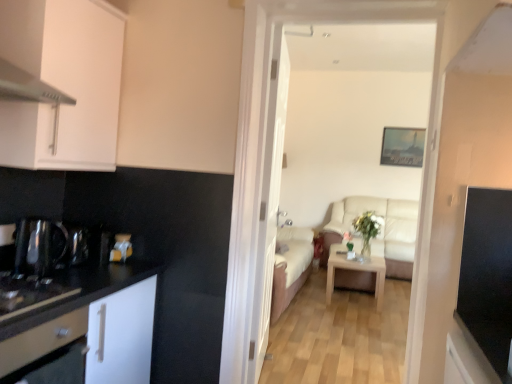
Describe the element at coordinates (487, 280) in the screenshot. I see `black glossy tv at right, the 2th appliance viewed from the left` at that location.

This screenshot has width=512, height=384. What do you see at coordinates (60, 84) in the screenshot? I see `white matte cabinet at upper left, acting as the first cabinetry starting from the top` at bounding box center [60, 84].

Find the location of a particular element. beige leather couch at center is located at coordinates (381, 232).

What is the approximate width of beige leather couch at center?

beige leather couch at center is 92.77 centimeters wide.

Measure the distance between black matte dishwasher at lower left and camera.

black matte dishwasher at lower left and camera are 1.25 meters apart from each other.

What do you see at coordinates (86, 326) in the screenshot? I see `white matte cabinet at left, the second cabinetry from the top` at bounding box center [86, 326].

The height and width of the screenshot is (384, 512). Identify the location of black glossy tv at right, which ranks as the first appliance in right-to-left order. (487, 280).

From the image's perspective, is white matte cabinet at upper left, the second cabinetry in the bottom-to-top sequence, below black glossy tv at right, which ranks as the first appliance in right-to-left order?

Actually, white matte cabinet at upper left, the second cabinetry in the bottom-to-top sequence, appears above black glossy tv at right, which ranks as the first appliance in right-to-left order, in the image.

Considering the relative sizes of white matte cabinet at upper left, the second cabinetry in the bottom-to-top sequence, and black glossy tv at right, which ranks as the first appliance in right-to-left order, in the image provided, is white matte cabinet at upper left, the second cabinetry in the bottom-to-top sequence, wider than black glossy tv at right, which ranks as the first appliance in right-to-left order,?

Indeed, white matte cabinet at upper left, the second cabinetry in the bottom-to-top sequence, has a greater width compared to black glossy tv at right, which ranks as the first appliance in right-to-left order.

What's the angular difference between white matte cabinet at upper left, the second cabinetry in the bottom-to-top sequence, and black glossy tv at right, the 2th appliance viewed from the left,'s facing directions?

90 degrees.

Is white matte cabinet at upper left, the second cabinetry in the bottom-to-top sequence, positioned far away from black glossy tv at right, the 2th appliance viewed from the left?

white matte cabinet at upper left, the second cabinetry in the bottom-to-top sequence, is far away from black glossy tv at right, the 2th appliance viewed from the left.

Between point (329, 274) and point (281, 110), which one is positioned in front?

The point (281, 110) is closer to the camera.

Between light wood/texture coffee table at center and white wooden door at center, which one has smaller width?

With smaller width is white wooden door at center.

Would you say light wood/texture coffee table at center is a long distance from white wooden door at center?

light wood/texture coffee table at center is positioned a significant distance from white wooden door at center.

Is light wood/texture coffee table at center at the right side of white wooden door at center?

Correct, you'll find light wood/texture coffee table at center to the right of white wooden door at center.

Considering the relative positions of beige fabric sofa at center and beige leather couch at center in the image provided, is beige fabric sofa at center behind beige leather couch at center?

No, beige fabric sofa at center is closer to the camera.

Is beige fabric sofa at center surrounding beige leather couch at center?

No, beige leather couch at center is located outside of beige fabric sofa at center.

Is point (372, 17) positioned in front of point (394, 203)?

That is True.

Considering the relative positions of beige fabric sofa at center and beige leather couch at center in the image provided, is beige fabric sofa at center to the left or to the right of beige leather couch at center?

Clearly, beige fabric sofa at center is on the left of beige leather couch at center in the image.

Which is more to the left, white matte cabinet at left, the second cabinetry from the top, or white glossy drawer at left?

Positioned to the left is white matte cabinet at left, the second cabinetry from the top.

Are white matte cabinet at left, the second cabinetry from the top, and white glossy drawer at left far apart?

No, there isn't a large distance between white matte cabinet at left, the second cabinetry from the top, and white glossy drawer at left.

Consider the image. Between white matte cabinet at left, the second cabinetry from the top, and white glossy drawer at left, which one has smaller width?

With smaller width is white glossy drawer at left.

Is white matte cabinet at upper left, acting as the first cabinetry starting from the top, not close to beige leather couch at center?

That's right, there is a large distance between white matte cabinet at upper left, acting as the first cabinetry starting from the top, and beige leather couch at center.

Can you tell me how much white matte cabinet at upper left, the second cabinetry in the bottom-to-top sequence, and beige leather couch at center differ in facing direction?

The facing directions of white matte cabinet at upper left, the second cabinetry in the bottom-to-top sequence, and beige leather couch at center are 91.7 degrees apart.

Between white matte cabinet at upper left, acting as the first cabinetry starting from the top, and beige leather couch at center, which one is positioned behind?

beige leather couch at center is behind.

Based on their sizes in the image, would you say white matte cabinet at upper left, the second cabinetry in the bottom-to-top sequence, is bigger or smaller than beige leather couch at center?

white matte cabinet at upper left, the second cabinetry in the bottom-to-top sequence, is smaller than beige leather couch at center.

Is white matte cabinet at upper left, the second cabinetry in the bottom-to-top sequence, beside beige fabric sofa at center?

There is a gap between white matte cabinet at upper left, the second cabinetry in the bottom-to-top sequence, and beige fabric sofa at center.

Considering the relative positions of white matte cabinet at upper left, acting as the first cabinetry starting from the top, and beige fabric sofa at center in the image provided, is white matte cabinet at upper left, acting as the first cabinetry starting from the top, behind beige fabric sofa at center?

That is False.

Is white matte cabinet at upper left, acting as the first cabinetry starting from the top, bigger than beige fabric sofa at center?

No, white matte cabinet at upper left, acting as the first cabinetry starting from the top, is not bigger than beige fabric sofa at center.

Is white matte cabinet at upper left, acting as the first cabinetry starting from the top, spatially inside beige fabric sofa at center, or outside of it?

white matte cabinet at upper left, acting as the first cabinetry starting from the top, exists outside the volume of beige fabric sofa at center.

Could you tell me if white wooden door at center is turned towards shiny metallic kettle at left, which appears as the second appliance when viewed from the right?

No, white wooden door at center is not turned towards shiny metallic kettle at left, which appears as the second appliance when viewed from the right.

From a real-world perspective, is white wooden door at center physically located above or below shiny metallic kettle at left, which appears as the second appliance when viewed from the right?

From a real-world perspective, white wooden door at center is physically above shiny metallic kettle at left, which appears as the second appliance when viewed from the right.

Which is less distant, [273,124] or [26,226]?

The point [26,226] is more forward.

Find the location of a particular element. Image resolution: width=512 pixels, height=384 pixels. the 2nd appliance in front of the white wooden door at center, counting from the anchor's position is located at coordinates (39, 247).

Where is `the 2nd appliance counting from the right of the white matte cabinet at upper left, the second cabinetry in the bottom-to-top sequence`? The width and height of the screenshot is (512, 384). the 2nd appliance counting from the right of the white matte cabinet at upper left, the second cabinetry in the bottom-to-top sequence is located at coordinates (487, 280).

Identify the location of door above the light wood/texture coffee table at center (from a real-world perspective). The width and height of the screenshot is (512, 384). (267, 202).

Estimate the real-world distances between objects in this image. Which object is further from beige leather couch at center, white glossy drawer at left or white wooden door at center?

white glossy drawer at left is further to beige leather couch at center.

When comparing their distances from beige leather couch at center, does white matte cabinet at upper left, acting as the first cabinetry starting from the top, or white glossy drawer at left seem further?

Among the two, white glossy drawer at left is located further to beige leather couch at center.

From the image, which object appears to be farther from white matte cabinet at left, arranged as the first cabinetry when ordered from the bottom, black matte sink at lower left or black glossy tv at right, which ranks as the first appliance in right-to-left order?

black glossy tv at right, which ranks as the first appliance in right-to-left order, is positioned further to the anchor white matte cabinet at left, arranged as the first cabinetry when ordered from the bottom.

From the image, which object appears to be nearer to white matte cabinet at left, the second cabinetry from the top, white wooden door at center or beige leather couch at center?

Among the two, white wooden door at center is located nearer to white matte cabinet at left, the second cabinetry from the top.

Consider the image. Which object lies further to the anchor point beige fabric sofa at center, black glossy tv at right, which ranks as the first appliance in right-to-left order, or white glossy drawer at left?

white glossy drawer at left lies further to beige fabric sofa at center than the other object.

From the image, which object appears to be farther from light wood/texture coffee table at center, white matte cabinet at left, arranged as the first cabinetry when ordered from the bottom, or shiny metallic kettle at left, the 1th appliance when ordered from left to right?

shiny metallic kettle at left, the 1th appliance when ordered from left to right, is further to light wood/texture coffee table at center.

From the image, which object appears to be nearer to white matte cabinet at left, arranged as the first cabinetry when ordered from the bottom, white matte cabinet at upper left, the second cabinetry in the bottom-to-top sequence, or light wood/texture coffee table at center?

white matte cabinet at upper left, the second cabinetry in the bottom-to-top sequence.

From the image, which object appears to be nearer to black glossy tv at right, which ranks as the first appliance in right-to-left order, shiny metallic kettle at left, the 1th appliance when ordered from left to right, or beige fabric sofa at center?

shiny metallic kettle at left, the 1th appliance when ordered from left to right, lies closer to black glossy tv at right, which ranks as the first appliance in right-to-left order, than the other object.

The height and width of the screenshot is (384, 512). In order to click on drawer between white matte cabinet at upper left, the second cabinetry in the bottom-to-top sequence, and black glossy tv at right, which ranks as the first appliance in right-to-left order, in the horizontal direction in this screenshot , I will do `click(42, 340)`.

This screenshot has width=512, height=384. I want to click on corridor between white glossy drawer at left and beige leather couch at center in the front-back direction, so click(354, 181).

Where is `cabinetry between white matte cabinet at left, the second cabinetry from the top, and beige leather couch at center from front to back`? The width and height of the screenshot is (512, 384). cabinetry between white matte cabinet at left, the second cabinetry from the top, and beige leather couch at center from front to back is located at coordinates (60, 84).

Identify the location of door located between beige fabric sofa at center and beige leather couch at center in the depth direction. This screenshot has width=512, height=384. (267, 202).